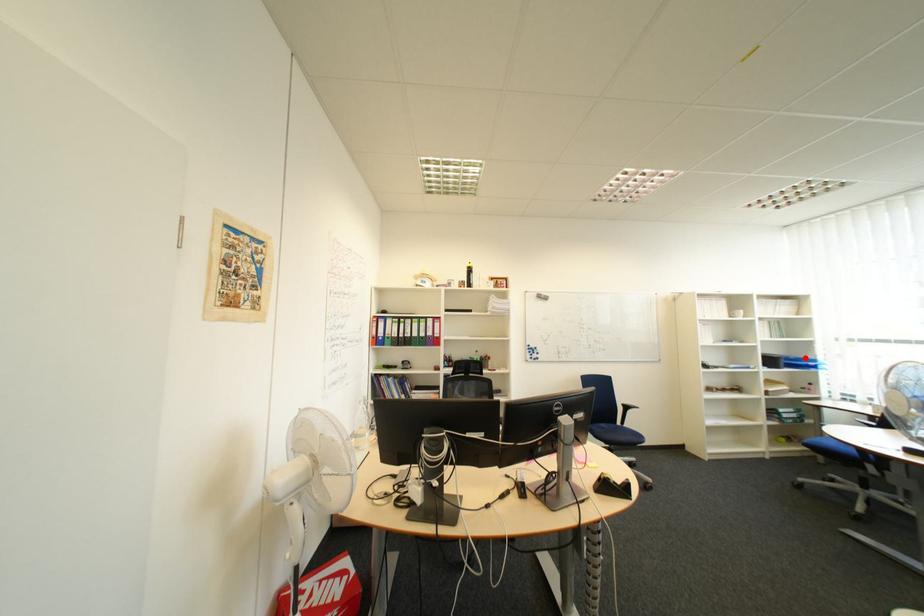
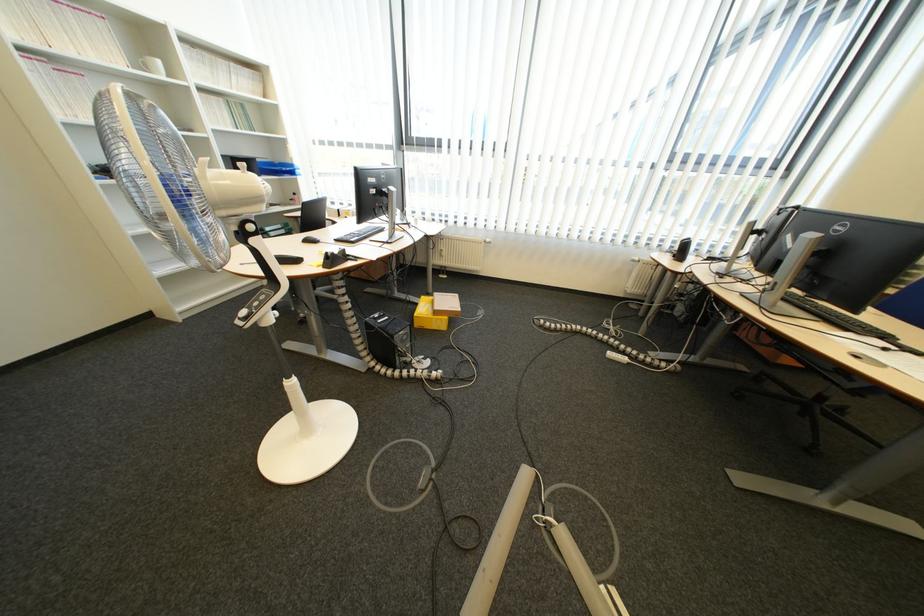
In the second image, find the point that corresponds to the highlighted location in the first image.

(289, 163)